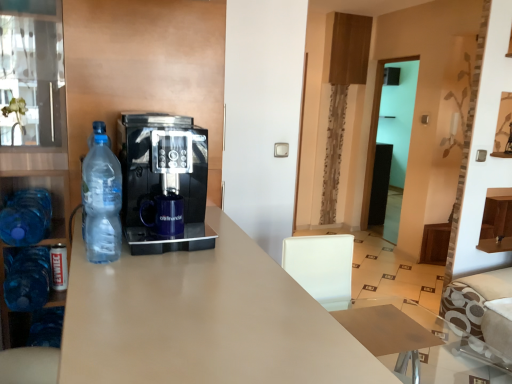
Question: From the image's perspective, is matte beige desk at center below blue glass cabinet at left?

Choices:
 (A) yes
 (B) no

Answer: (A)

Question: Considering the relative sizes of matte beige desk at center and blue glass cabinet at left in the image provided, is matte beige desk at center shorter than blue glass cabinet at left?

Choices:
 (A) yes
 (B) no

Answer: (A)

Question: Is matte beige desk at center outside of blue glass cabinet at left?

Choices:
 (A) yes
 (B) no

Answer: (A)

Question: Are matte beige desk at center and blue glass cabinet at left making contact?

Choices:
 (A) yes
 (B) no

Answer: (B)

Question: Does matte beige desk at center turn towards blue glass cabinet at left?

Choices:
 (A) yes
 (B) no

Answer: (B)

Question: Based on their sizes in the image, would you say blue plastic bottle at left, marked as the second bottle in a left-to-right arrangement, is bigger or smaller than clear plastic bottle at left, which is the third bottle in back-to-front order?

Choices:
 (A) big
 (B) small

Answer: (A)

Question: From a real-world perspective, is blue plastic bottle at left, which is the 2th bottle from front to back, physically located above or below clear plastic bottle at left, which is counted as the first bottle, starting from the right?

Choices:
 (A) below
 (B) above

Answer: (A)

Question: Is blue plastic bottle at left, the 2th bottle viewed from the right, inside or outside of clear plastic bottle at left, marked as the third bottle in a left-to-right arrangement?

Choices:
 (A) inside
 (B) outside

Answer: (B)

Question: In terms of width, does blue plastic bottle at left, the 2th bottle viewed from the right, look wider or thinner when compared to clear plastic bottle at left, which is counted as the first bottle, starting from the right?

Choices:
 (A) thin
 (B) wide

Answer: (B)

Question: From their relative heights in the image, would you say matte beige desk at center is taller or shorter than clear plastic bottle at left, which is the third bottle in back-to-front order?

Choices:
 (A) tall
 (B) short

Answer: (A)

Question: Considering the positions of point (237, 367) and point (115, 251), is point (237, 367) closer or farther from the camera than point (115, 251)?

Choices:
 (A) farther
 (B) closer

Answer: (B)

Question: Is matte beige desk at center inside or outside of clear plastic bottle at left, which is counted as the first bottle, starting from the right?

Choices:
 (A) inside
 (B) outside

Answer: (B)

Question: Relative to clear plastic bottle at left, which is the third bottle in back-to-front order, is matte beige desk at center in front or behind?

Choices:
 (A) front
 (B) behind

Answer: (A)

Question: Considering the relative positions of clear plastic bottle at left, which is counted as the first bottle, starting from the right, and matte beige desk at center in the image provided, is clear plastic bottle at left, which is counted as the first bottle, starting from the right, to the left or to the right of matte beige desk at center?

Choices:
 (A) left
 (B) right

Answer: (A)

Question: Considering the positions of clear plastic bottle at left, the third bottle from the bottom, and matte beige desk at center in the image, is clear plastic bottle at left, the third bottle from the bottom, wider or thinner than matte beige desk at center?

Choices:
 (A) thin
 (B) wide

Answer: (A)